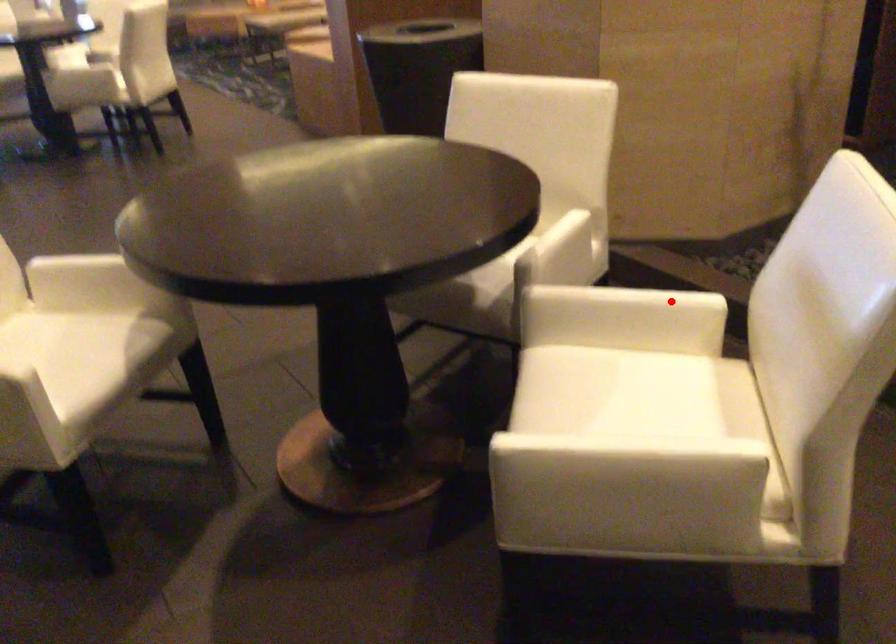
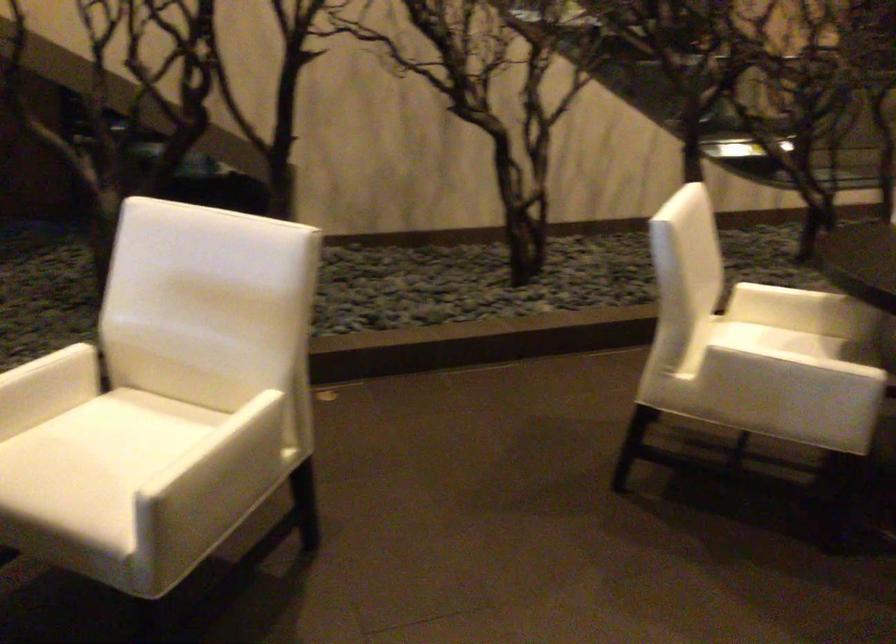
Where in the second image is the point corresponding to the highlighted location from the first image?

(58, 362)